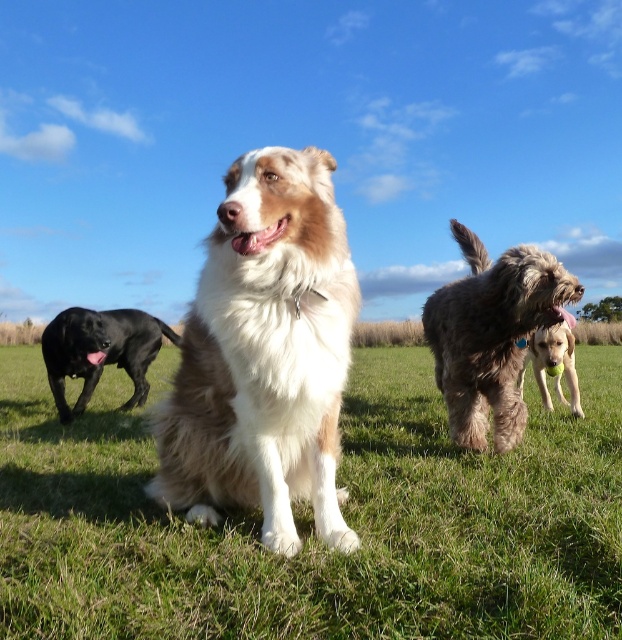
Question: Which of the following is the closest to the observer?

Choices:
 (A) [x=488, y=403]
 (B) [x=544, y=388]
 (C) [x=364, y=561]
 (D) [x=128, y=340]

Answer: (C)

Question: Is brown/white fur dog at center closer to camera compared to golden fur ball at center?

Choices:
 (A) no
 (B) yes

Answer: (B)

Question: Among these points, which one is farthest from the camera?

Choices:
 (A) coord(72,352)
 (B) coord(452,369)

Answer: (A)

Question: Is white fluffy dog at center positioned at the back of shiny black dog at left?

Choices:
 (A) no
 (B) yes

Answer: (A)

Question: Does brown/white fur dog at center have a larger size compared to golden fur ball at center?

Choices:
 (A) no
 (B) yes

Answer: (A)

Question: Which of the following is the closest to the observer?

Choices:
 (A) (165, 333)
 (B) (524, 307)
 (C) (251, 497)

Answer: (C)